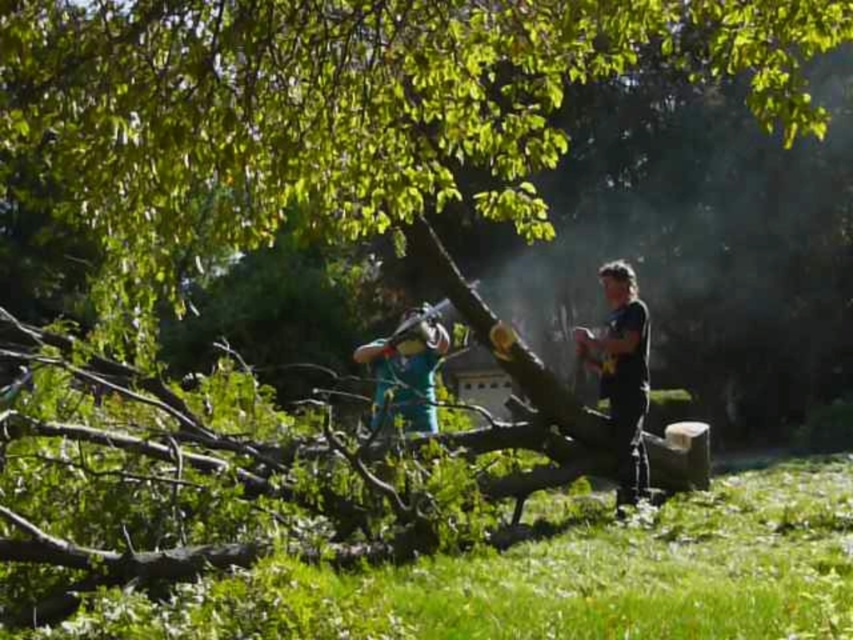
Is black matte shirt at right bigger than green matte shirt at center?

No, black matte shirt at right is not bigger than green matte shirt at center.

Who is higher up, black matte shirt at right or green matte shirt at center?

Positioned higher is black matte shirt at right.

Locate an element on the screen. The image size is (853, 640). black matte shirt at right is located at coordinates tap(622, 374).